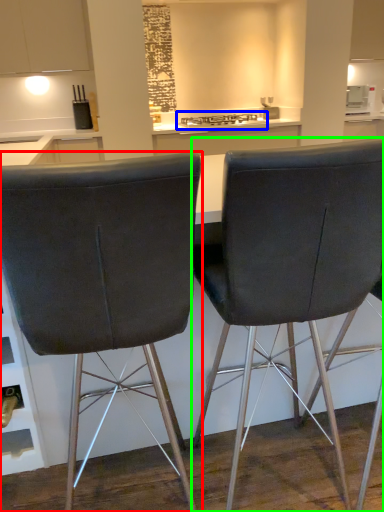
Question: Considering the real-world distances, which object is closest to chair (highlighted by a red box)? gas stove (highlighted by a blue box) or chair (highlighted by a green box).

Choices:
 (A) gas stove
 (B) chair

Answer: (B)